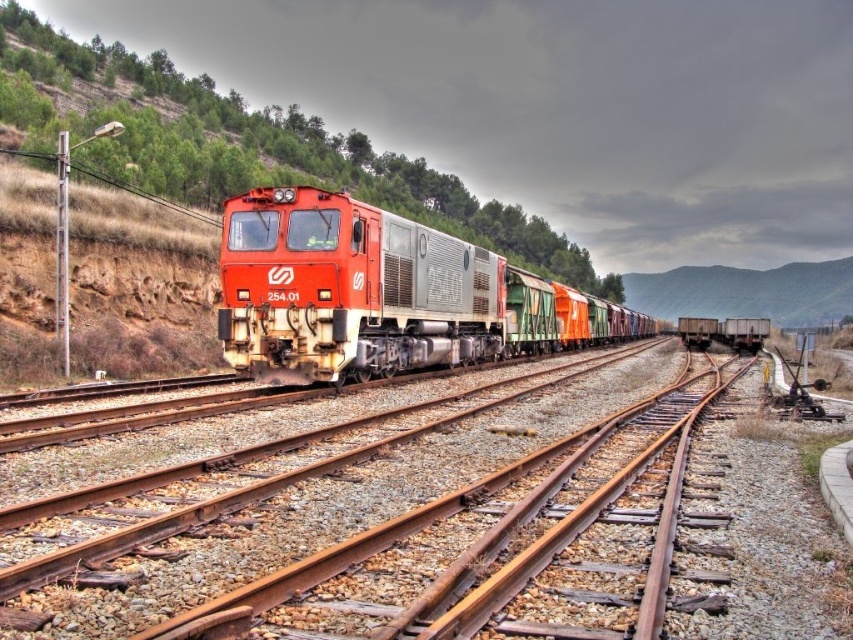
Between rusty metal tracks at center and matte red train at center, which one appears on the left side from the viewer's perspective?

matte red train at center

Looking at this image, is rusty metal tracks at center below matte red train at center?

Yes, rusty metal tracks at center is below matte red train at center.

Does point (426, 449) come in front of point (534, 320)?

Yes, point (426, 449) is in front of point (534, 320).

The image size is (853, 640). Find the location of `rusty metal tracks at center`. rusty metal tracks at center is located at coordinates (340, 529).

Between rusty metal tracks at center and green matte hillside at center, which one appears on the right side from the viewer's perspective?

green matte hillside at center

Between point (537, 412) and point (691, 304), which one is positioned in front?

Point (537, 412)

Image resolution: width=853 pixels, height=640 pixels. What do you see at coordinates (340, 529) in the screenshot?
I see `rusty metal tracks at center` at bounding box center [340, 529].

Locate an element on the screen. The image size is (853, 640). rusty metal tracks at center is located at coordinates (340, 529).

Consider the image. Is matte red train at center to the right of green matte hillside at center from the viewer's perspective?

No, matte red train at center is not to the right of green matte hillside at center.

Which is in front, point (457, 362) or point (759, 308)?

Point (457, 362) is in front.

This screenshot has height=640, width=853. I want to click on matte red train at center, so click(x=363, y=292).